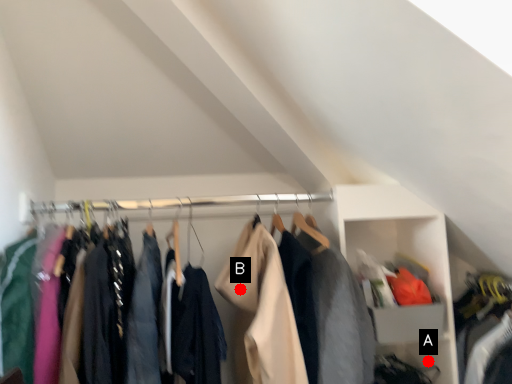
Question: Two points are circled on the image, labeled by A and B beside each circle. Among these points, which one is farthest from the camera?

Choices:
 (A) A is further
 (B) B is further

Answer: (A)